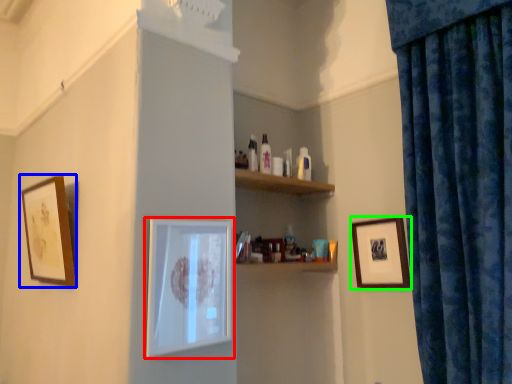
Question: Based on their relative distances, which object is nearer to picture frame (highlighted by a red box)? Choose from picture frame (highlighted by a blue box) and picture frame (highlighted by a green box).

Choices:
 (A) picture frame
 (B) picture frame

Answer: (A)